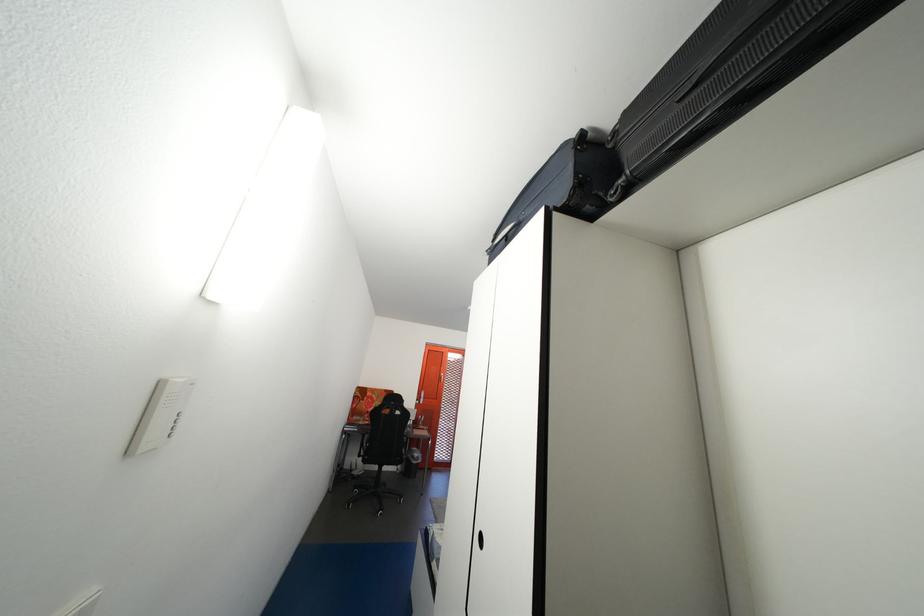
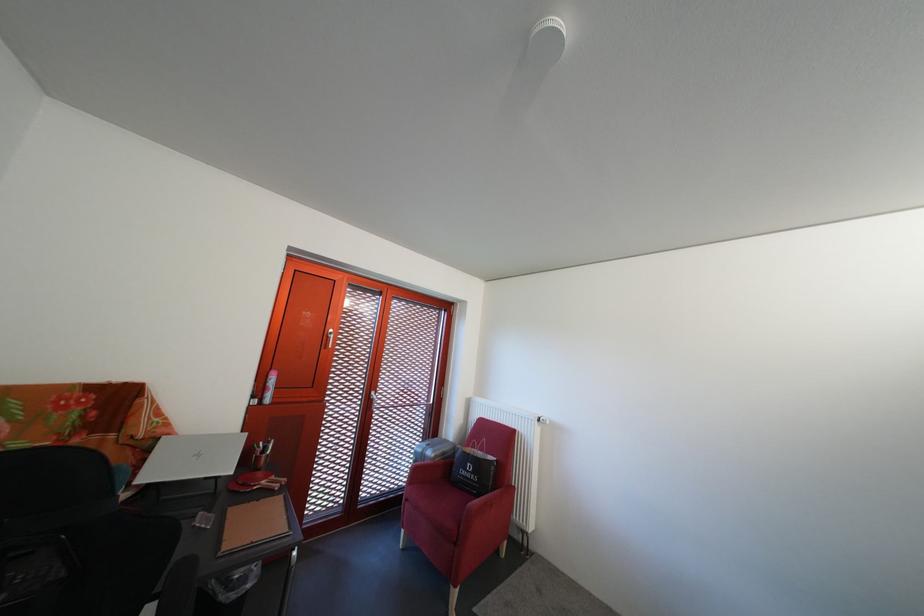
Question: The images are taken continuously from a first-person perspective. In which direction are you moving?

Choices:
 (A) Left
 (B) Right
 (C) Forward
 (D) Backward

Answer: (C)